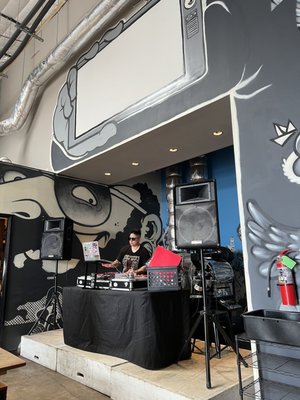
Locate an element on the screen. This screenshot has height=400, width=300. basket is located at coordinates (167, 276).